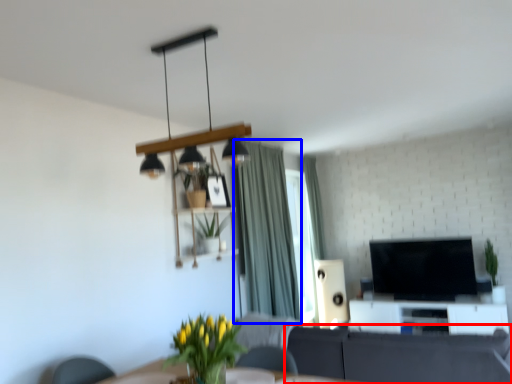
Question: Which object is further to the camera taking this photo, studio couch (highlighted by a red box) or curtain (highlighted by a blue box)?

Choices:
 (A) studio couch
 (B) curtain

Answer: (B)